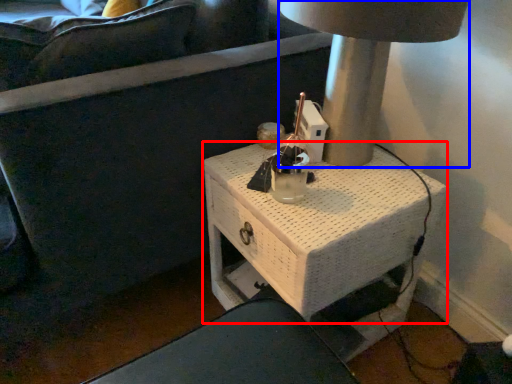
Question: Among these objects, which one is nearest to the camera, table (highlighted by a red box) or table lamp (highlighted by a blue box)?

Choices:
 (A) table
 (B) table lamp

Answer: (B)